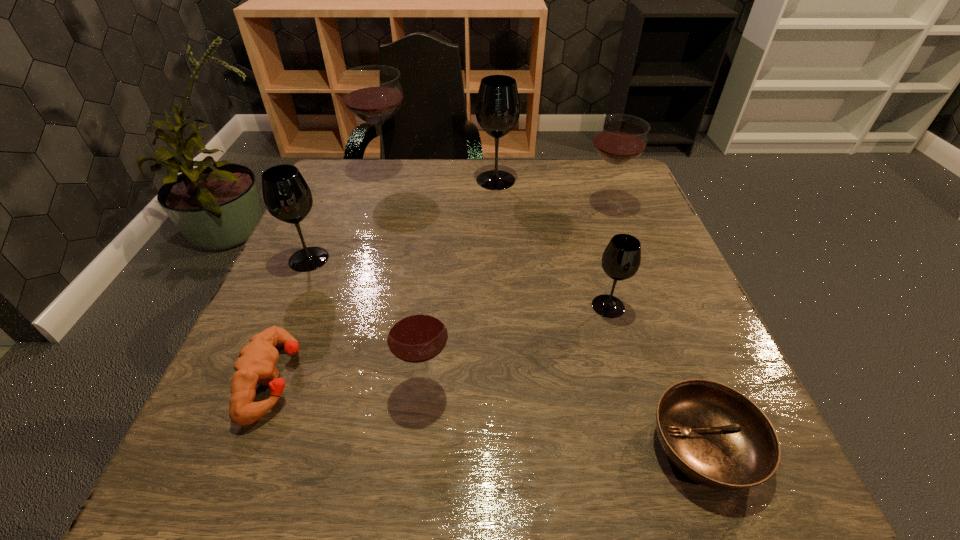
The height and width of the screenshot is (540, 960). Find the location of `gray wineglass that is the third closest to the red puncher`. gray wineglass that is the third closest to the red puncher is located at coordinates (497, 109).

Choose which red wineglass is the nearest neighbor to the smallest red wineglass. Please provide its 2D coordinates. Your answer should be formatted as a tuple, i.e. [(x, y)], where the tuple contains the x and y coordinates of a point satisfying the conditions above.

[(620, 138)]

Locate which red wineglass is the closest to the second gray wineglass from right to left. Please provide its 2D coordinates. Your answer should be formatted as a tuple, i.e. [(x, y)], where the tuple contains the x and y coordinates of a point satisfying the conditions above.

[(620, 138)]

At what (x,y) coordinates should I click in order to perform the action: click on vacant area in the image that satisfies the following two spatial constraints: 1. with the gloves of the red puncher facing forward; 2. on the right side of the soup bowl. Please return your answer as a coordinate pair (x, y). Looking at the image, I should click on (248, 447).

Where is `free location that satisfies the following two spatial constraints: 1. with the gloves of the smallest red wineglass facing forward; 2. on the right side of the puncher`? free location that satisfies the following two spatial constraints: 1. with the gloves of the smallest red wineglass facing forward; 2. on the right side of the puncher is located at coordinates (272, 386).